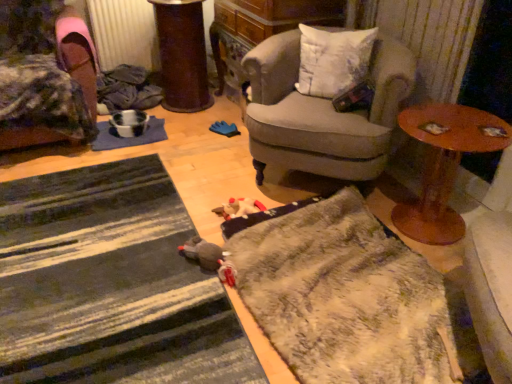
Measure the distance between metallic silver radiator at upper left and camera.

The depth of metallic silver radiator at upper left is 2.93 meters.

This screenshot has height=384, width=512. Describe the element at coordinates (110, 285) in the screenshot. I see `striped fabric doormat at lower left, placed as the 2th doormat when sorted from right to left` at that location.

This screenshot has height=384, width=512. Describe the element at coordinates (128, 138) in the screenshot. I see `blue fabric mat at center-left` at that location.

In order to face white soft cushion at upper right, should I rotate leftwards or rightwards?

Turn right approximately 10.526 degrees to face it.

What do you see at coordinates (444, 165) in the screenshot?
I see `wooden round table at right` at bounding box center [444, 165].

Where is `fuzzy gray doormat at lower center, positioned as the 1th doormat in right-to-left order`? This screenshot has height=384, width=512. fuzzy gray doormat at lower center, positioned as the 1th doormat in right-to-left order is located at coordinates (343, 295).

This screenshot has height=384, width=512. Identify the location of gray fabric armchair at center, arranged as the first chair when viewed from the right. (322, 112).

Is wooden round table at right positioned with its back to striped fabric doormat at lower left, the 1th doormat in the left-to-right sequence?

No.

Considering the positions of objects wooden round table at right and striped fabric doormat at lower left, placed as the 2th doormat when sorted from right to left, in the image provided, who is more to the right, wooden round table at right or striped fabric doormat at lower left, placed as the 2th doormat when sorted from right to left,?

wooden round table at right.

You are a GUI agent. You are given a task and a screenshot of the screen. Output one action in this format:
    pyautogui.click(x=<x>, y=<y>)
    Task: Click on the table behind the striped fabric doormat at lower left, the 1th doormat in the left-to-right sequence
    
    Given the screenshot: What is the action you would take?
    pyautogui.click(x=444, y=165)

Between wooden round table at right and striped fabric doormat at lower left, placed as the 2th doormat when sorted from right to left, which one has smaller size?

wooden round table at right is smaller.

Considering the positions of objects striped fabric doormat at lower left, the 1th doormat in the left-to-right sequence, and blue fabric mat at center-left in the image provided, who is more to the left, striped fabric doormat at lower left, the 1th doormat in the left-to-right sequence, or blue fabric mat at center-left?

From the viewer's perspective, blue fabric mat at center-left appears more on the left side.

Find the location of `mat on the left of the striped fabric doormat at lower left, the 1th doormat in the left-to-right sequence`. mat on the left of the striped fabric doormat at lower left, the 1th doormat in the left-to-right sequence is located at coordinates pyautogui.click(x=128, y=138).

What's the angular difference between striped fabric doormat at lower left, the 1th doormat in the left-to-right sequence, and blue fabric mat at center-left's facing directions?

striped fabric doormat at lower left, the 1th doormat in the left-to-right sequence, and blue fabric mat at center-left are facing 0.685 degrees away from each other.

Can you confirm if striped fabric doormat at lower left, placed as the 2th doormat when sorted from right to left, is thinner than blue fabric mat at center-left?

Incorrect, the width of striped fabric doormat at lower left, placed as the 2th doormat when sorted from right to left, is not less than that of blue fabric mat at center-left.

How different are the orientations of striped fabric doormat at lower left, placed as the 2th doormat when sorted from right to left, and white soft cushion at upper right in degrees?

The angle between the facing direction of striped fabric doormat at lower left, placed as the 2th doormat when sorted from right to left, and the facing direction of white soft cushion at upper right is 51.7 degrees.

Looking at the image, does striped fabric doormat at lower left, placed as the 2th doormat when sorted from right to left, seem bigger or smaller compared to white soft cushion at upper right?

Clearly, striped fabric doormat at lower left, placed as the 2th doormat when sorted from right to left, is larger in size than white soft cushion at upper right.

Is striped fabric doormat at lower left, the 1th doormat in the left-to-right sequence, not near white soft cushion at upper right?

striped fabric doormat at lower left, the 1th doormat in the left-to-right sequence, is positioned a significant distance from white soft cushion at upper right.

From the picture: From a real-world perspective, is striped fabric doormat at lower left, the 1th doormat in the left-to-right sequence, above or below white soft cushion at upper right?

From a real-world perspective, striped fabric doormat at lower left, the 1th doormat in the left-to-right sequence, is physically below white soft cushion at upper right.

Between blue fabric mat at center-left and gray fabric armchair at center, arranged as the first chair when viewed from the right, which one appears on the right side from the viewer's perspective?

gray fabric armchair at center, arranged as the first chair when viewed from the right, is more to the right.

Measure the distance between blue fabric mat at center-left and gray fabric armchair at center, arranged as the 2th chair when viewed from the left.

The distance of blue fabric mat at center-left from gray fabric armchair at center, arranged as the 2th chair when viewed from the left, is 3.72 feet.

Does point (136, 140) come in front of point (379, 125)?

No, (136, 140) is further to viewer.

Could you tell me if velvet fabric chair at left, the second chair positioned from the right, is facing blue fabric mat at center-left?

No, velvet fabric chair at left, the second chair positioned from the right, does not turn towards blue fabric mat at center-left.

From a real-world perspective, is velvet fabric chair at left, the second chair positioned from the right, under blue fabric mat at center-left?

Actually, velvet fabric chair at left, the second chair positioned from the right, is physically above blue fabric mat at center-left in the real world.

Does velvet fabric chair at left, the second chair positioned from the right, have a lesser height compared to blue fabric mat at center-left?

No, velvet fabric chair at left, the second chair positioned from the right, is not shorter than blue fabric mat at center-left.

Is white soft cushion at upper right located within blue fabric mat at center-left?

No, white soft cushion at upper right is not a part of blue fabric mat at center-left.

Which is less distant, (x=129, y=143) or (x=342, y=67)?

Clearly, point (x=129, y=143) is more distant from the camera than point (x=342, y=67).

Could you tell me if blue fabric mat at center-left is turned towards white soft cushion at upper right?

No, blue fabric mat at center-left is not oriented towards white soft cushion at upper right.

In terms of height, does blue fabric mat at center-left look taller or shorter compared to white soft cushion at upper right?

In the image, blue fabric mat at center-left appears to be shorter than white soft cushion at upper right.

Is white soft cushion at upper right aimed at fuzzy gray doormat at lower center, positioned as the 1th doormat in right-to-left order?

Yes, white soft cushion at upper right is facing fuzzy gray doormat at lower center, positioned as the 1th doormat in right-to-left order.

Is point (343, 77) closer or farther from the camera than point (329, 281)?

Point (343, 77) is positioned farther from the camera compared to point (329, 281).

From a real-world perspective, who is located higher, white soft cushion at upper right or fuzzy gray doormat at lower center, which appears as the 2th doormat when viewed from the left?

white soft cushion at upper right, from a real-world perspective.

I want to click on the 1st doormat counting from the left side of the white soft cushion at upper right, so click(x=343, y=295).

Identify the location of table behind the striped fabric doormat at lower left, placed as the 2th doormat when sorted from right to left. The image size is (512, 384). (444, 165).

This screenshot has width=512, height=384. In order to click on mat that appears above the striped fabric doormat at lower left, the 1th doormat in the left-to-right sequence (from the image's perspective) in this screenshot , I will do `click(128, 138)`.

Which object lies further to the anchor point wooden round table at right, velvet fabric chair at left, the second chair positioned from the right, or metallic silver radiator at upper left?

metallic silver radiator at upper left.

Based on the photo, considering their positions, is striped fabric doormat at lower left, placed as the 2th doormat when sorted from right to left, positioned closer to white soft cushion at upper right than metallic silver radiator at upper left?

striped fabric doormat at lower left, placed as the 2th doormat when sorted from right to left, is positioned closer to the anchor white soft cushion at upper right.

From the image, which object appears to be nearer to blue fabric mat at center-left, wooden round table at right or fuzzy gray doormat at lower center, which appears as the 2th doormat when viewed from the left?

fuzzy gray doormat at lower center, which appears as the 2th doormat when viewed from the left, is positioned closer to the anchor blue fabric mat at center-left.

Looking at the image, which one is located further to fuzzy gray doormat at lower center, which appears as the 2th doormat when viewed from the left, striped fabric doormat at lower left, placed as the 2th doormat when sorted from right to left, or white soft cushion at upper right?

white soft cushion at upper right.

Estimate the real-world distances between objects in this image. Which object is further from metallic silver radiator at upper left, striped fabric doormat at lower left, placed as the 2th doormat when sorted from right to left, or gray fabric armchair at center, arranged as the 2th chair when viewed from the left?

The object further to metallic silver radiator at upper left is striped fabric doormat at lower left, placed as the 2th doormat when sorted from right to left.

Estimate the real-world distances between objects in this image. Which object is further from wooden round table at right, fuzzy gray doormat at lower center, which appears as the 2th doormat when viewed from the left, or metallic silver radiator at upper left?

metallic silver radiator at upper left is further to wooden round table at right.

When comparing their distances from metallic silver radiator at upper left, does blue fabric mat at center-left or gray fabric armchair at center, arranged as the first chair when viewed from the right, seem closer?

Among the two, blue fabric mat at center-left is located nearer to metallic silver radiator at upper left.

Considering their positions, is gray fabric armchair at center, arranged as the 2th chair when viewed from the left, positioned closer to white soft cushion at upper right than velvet fabric chair at left, which is the 1th chair from left to right?

The object closer to white soft cushion at upper right is gray fabric armchair at center, arranged as the 2th chair when viewed from the left.

Identify the location of pillow situated between velvet fabric chair at left, the second chair positioned from the right, and wooden round table at right from left to right. (333, 60).

Image resolution: width=512 pixels, height=384 pixels. I want to click on doormat between striped fabric doormat at lower left, placed as the 2th doormat when sorted from right to left, and metallic silver radiator at upper left from front to back, so click(343, 295).

In order to click on pillow between striped fabric doormat at lower left, the 1th doormat in the left-to-right sequence, and metallic silver radiator at upper left from front to back in this screenshot , I will do `click(333, 60)`.

The image size is (512, 384). In order to click on pillow between striped fabric doormat at lower left, the 1th doormat in the left-to-right sequence, and blue fabric mat at center-left in the front-back direction in this screenshot , I will do pyautogui.click(x=333, y=60).